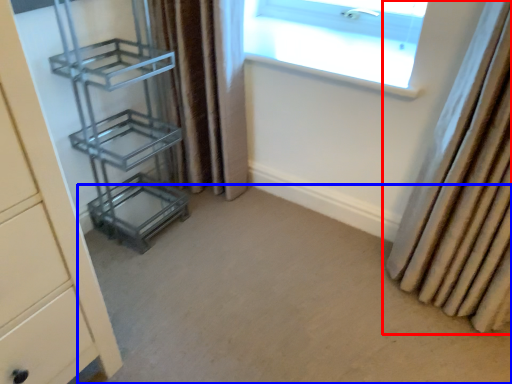
Question: Which of the following is the closest to the observer, curtain (highlighted by a red box) or plain (highlighted by a blue box)?

Choices:
 (A) curtain
 (B) plain

Answer: (B)